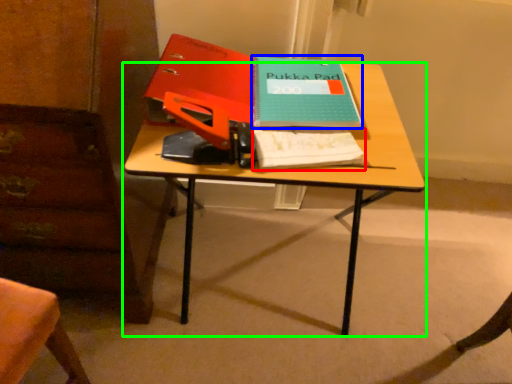
Question: Considering the real-world distances, which object is farthest from notebook (highlighted by a red box)? paperback book (highlighted by a blue box) or desk (highlighted by a green box)?

Choices:
 (A) paperback book
 (B) desk

Answer: (A)